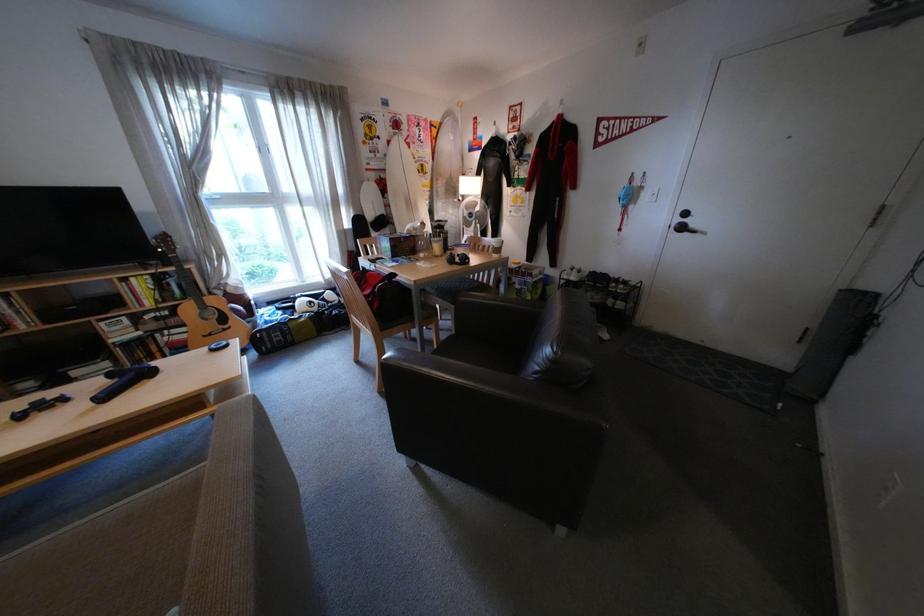
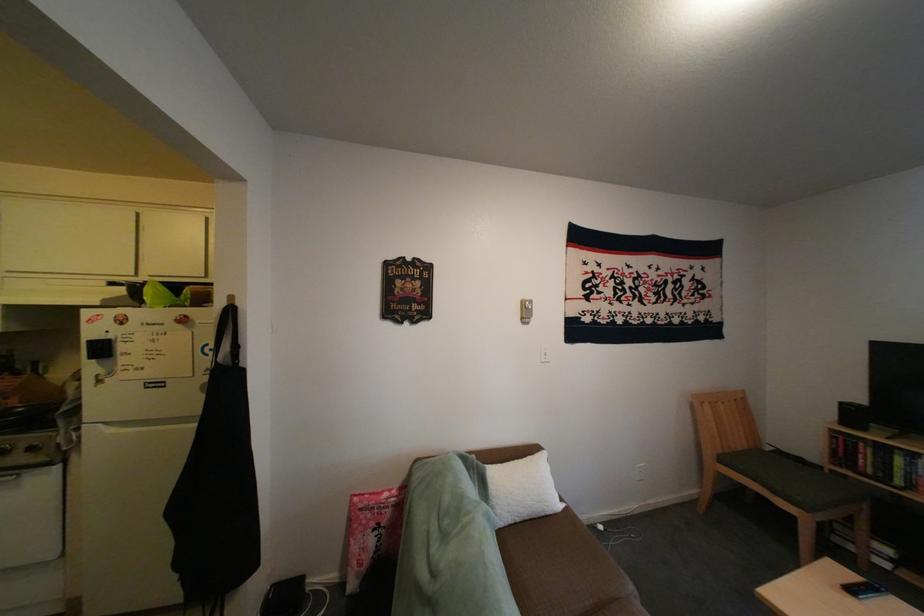
Question: Based on the continuous images, in which direction is the camera rotating? Reply with the corresponding letter.

Choices:
 (A) Left
 (B) Right
 (C) Up
 (D) Down

Answer: (A)